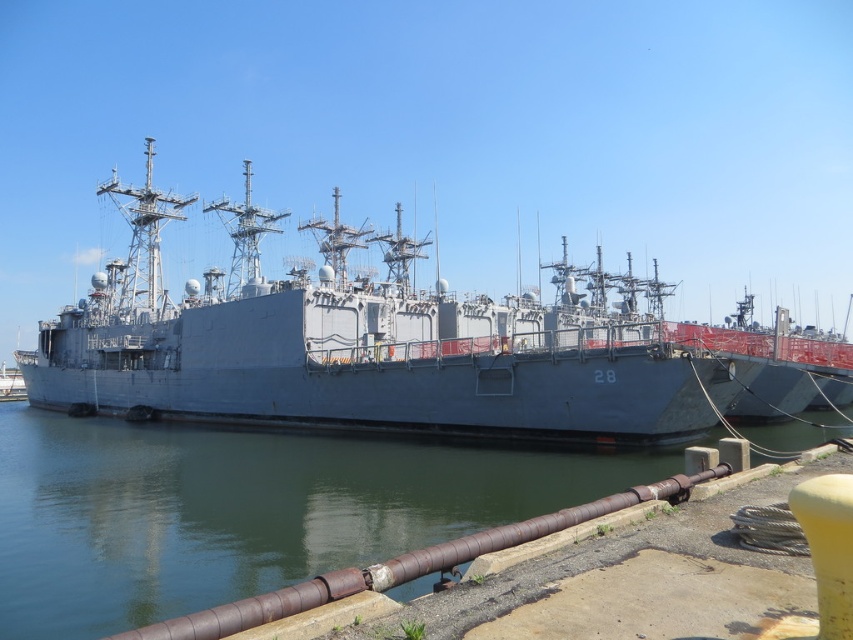
Can you confirm if gray metallic ship at center is bigger than greenish water at lower left?

Correct, gray metallic ship at center is larger in size than greenish water at lower left.

What do you see at coordinates (369, 344) in the screenshot?
I see `gray metallic ship at center` at bounding box center [369, 344].

Measure the distance between gray metallic ship at center and camera.

gray metallic ship at center is 205.40 feet from camera.

This screenshot has width=853, height=640. I want to click on gray metallic ship at center, so click(x=369, y=344).